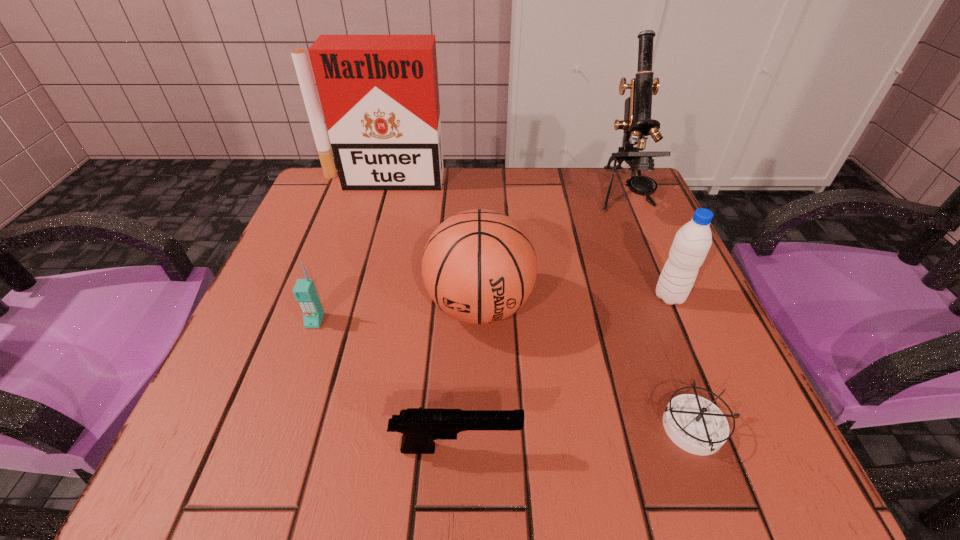
Image resolution: width=960 pixels, height=540 pixels. Identify the location of microscope. (637, 123).

The width and height of the screenshot is (960, 540). Identify the location of cigarette case. (379, 94).

I want to click on basketball, so click(479, 266).

I want to click on water bottle, so click(x=691, y=244).

Locate an element on the screen. Image resolution: width=960 pixels, height=540 pixels. cellular telephone is located at coordinates (305, 292).

I want to click on the sixth tallest object, so click(419, 427).

Identify the location of the shortest object. This screenshot has width=960, height=540. (696, 425).

The image size is (960, 540). What are the coordinates of `vacant space positioned through the eyepiece of the microscope` in the screenshot? It's located at (664, 294).

Locate an element on the screen. The image size is (960, 540). vacant space located 0.230m on the front-facing side of the cigarette case is located at coordinates (361, 252).

At what (x,y) coordinates should I click in order to perform the action: click on vacant point located on the surface of the basketball near the brand logo. Please return your answer as a coordinate pair (x, y). The height and width of the screenshot is (540, 960). Looking at the image, I should click on (479, 447).